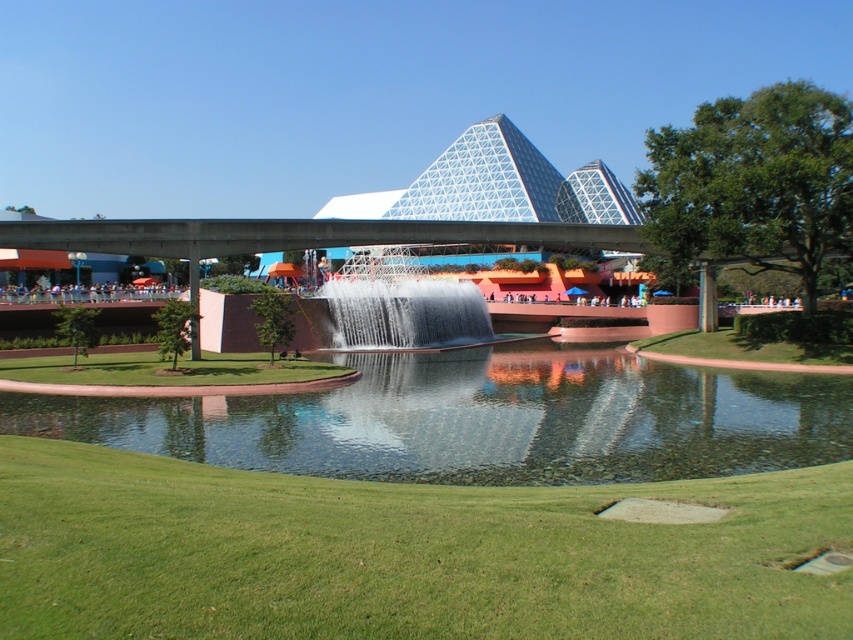
You are standing in front of the modern architectural structure with two pyramids and a reflecting pool. You notice two points marked in the image. One is at coordinate point (426, 536) and the other at point (529, 381). Which of these points is nearer to your current position?

Point (426, 536) is closer to the camera than point (529, 381), so the point at (426, 536) is nearer to your current position.

You are a visitor standing on the green grassy golf course at lower center and want to reach the clear glass waterfall at center. According to the scene, which direction should you move to get there?

The green grassy golf course at lower center is located below the clear glass waterfall at center, so you should move upward to reach the clear glass waterfall at center.